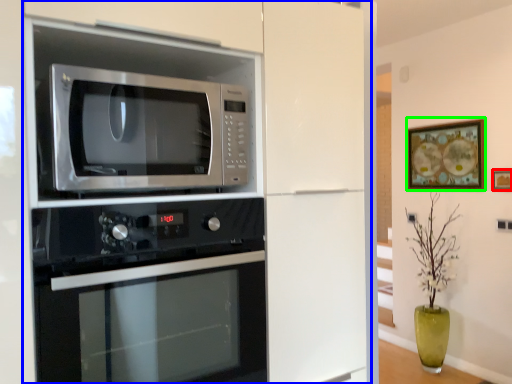
Question: Based on their relative distances, which object is nearer to picture frame (highlighted by a red box)? Choose from cabinetry (highlighted by a blue box) and picture frame (highlighted by a green box).

Choices:
 (A) cabinetry
 (B) picture frame

Answer: (B)